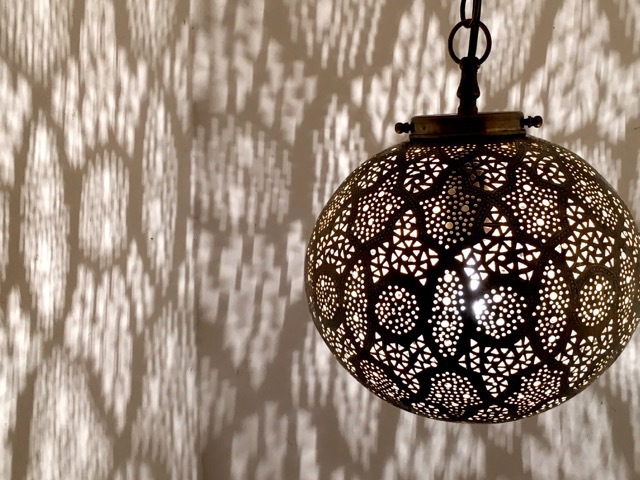
What are the coordinates of `decorative sphere` in the screenshot? It's located at (513, 254).